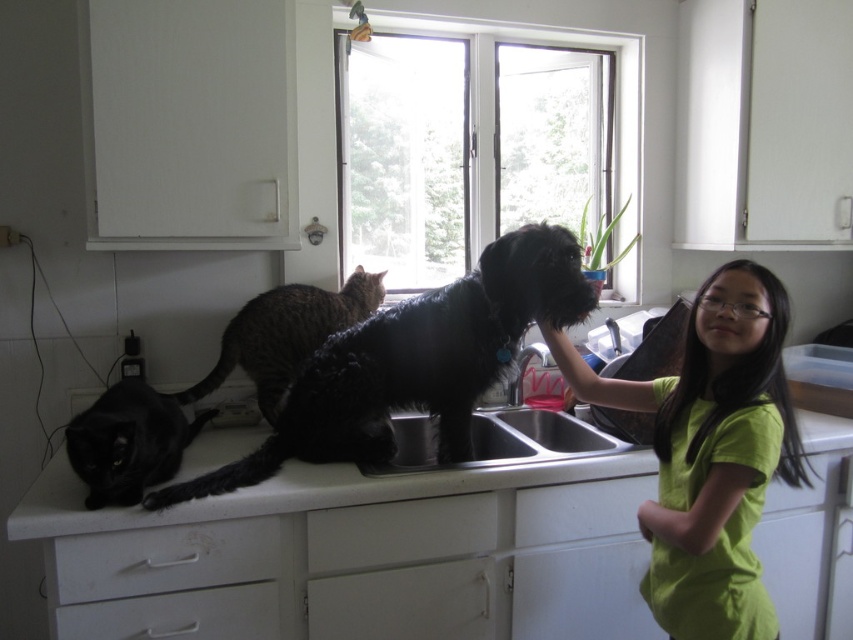
You are a person trying to reach an item on the counter between the green matte shirt at center and the white matte drawer at lower center. Which object is closer to you?

The white matte drawer at lower center is closer to you because it is positioned lower than the green matte shirt at center, which is taller and located above it.

You are a person in the kitchen and you want to place a tall vase on a surface. Which object between the white matte counter top at center and the white matte drawer at center would be more suitable for placing the tall vase?

The white matte counter top at center is much taller than the white matte drawer at center, so the counter top would be more suitable for placing the tall vase as it provides a taller surface.

You are a robotic arm that needs to pick up the shiny black cat at left and place it on the white matte drawer at lower center. The robotic arm has a maximum reach of 35 inches. Can it do this task without moving its base?

The shiny black cat at left and white matte drawer at lower center are 36.07 inches apart. Since the robotic arm can only reach 35 inches, it cannot complete the task without moving its base.